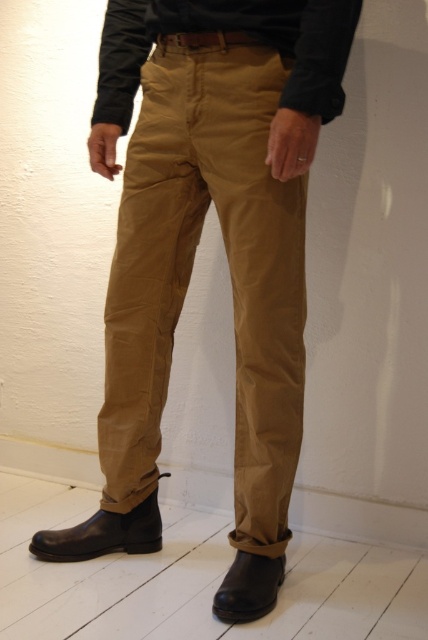
You are a fashion designer trying to create a matching belt for the outfit shown. The belt must fit snugly around the tan cotton pants at center and the black leather boot at lower center. Given their widths, which item requires a wider belt measurement?

The tan cotton pants at center requires a wider belt measurement since its width is larger than the black leather boot at lower center.

From the picture: You are a photographer setting up a shoot in the room described. You notice the black leather boot at lower left and the black leather boot at lower center in the image. Which boot is positioned higher on the person?

The black leather boot at lower left is positioned higher on the person because it is above the black leather boot at lower center.